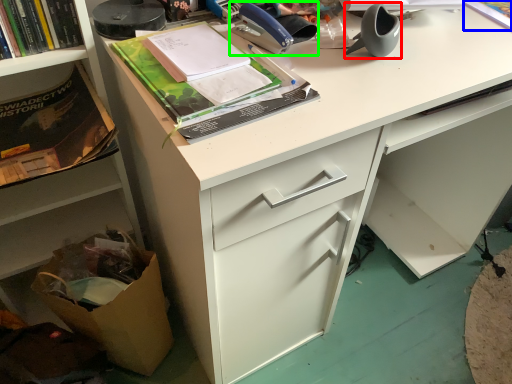
Question: Based on their relative distances, which object is nearer to office supplies (highlighted by a red box)? Choose from book (highlighted by a blue box) and office supplies (highlighted by a green box).

Choices:
 (A) book
 (B) office supplies

Answer: (B)